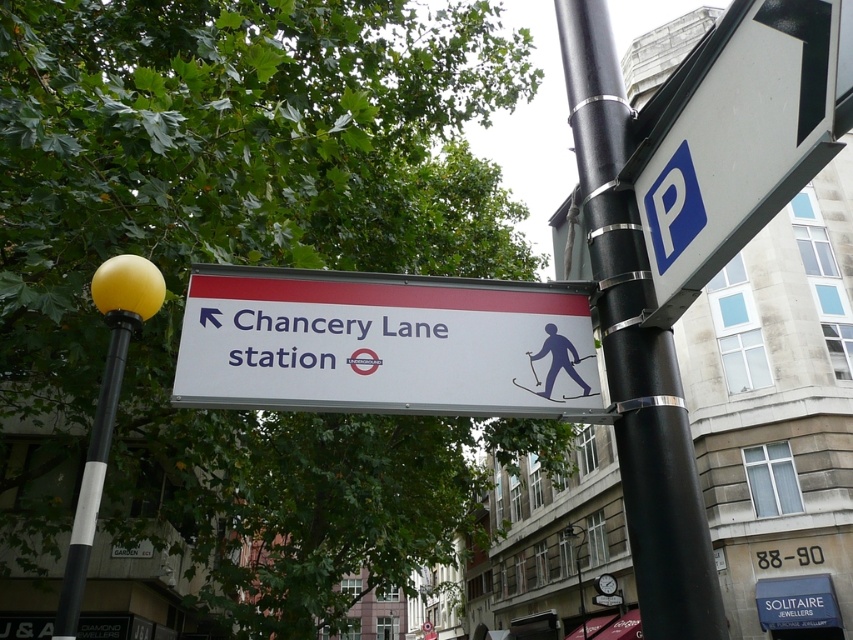
Question: Is blue plastic parking sign at upper right smaller than black metallic pole at upper right?

Choices:
 (A) no
 (B) yes

Answer: (B)

Question: Does white plastic sign at center have a lesser width compared to black metallic pole at upper right?

Choices:
 (A) no
 (B) yes

Answer: (A)

Question: Which of the following is the closest to the observer?

Choices:
 (A) matte blue skier at center
 (B) blue plastic parking sign at upper right

Answer: (B)

Question: Which point is closer to the camera taking this photo?

Choices:
 (A) (553, 365)
 (B) (572, 330)
 (C) (630, 512)
 (D) (705, 77)

Answer: (D)

Question: Estimate the real-world distances between objects in this image. Which object is farther from the white plastic sign at center?

Choices:
 (A) matte blue skier at center
 (B) blue plastic parking sign at upper right
 (C) black metallic pole at upper right

Answer: (B)

Question: Considering the relative positions of white plastic sign at center and matte blue skier at center in the image provided, where is white plastic sign at center located with respect to matte blue skier at center?

Choices:
 (A) above
 (B) below

Answer: (A)